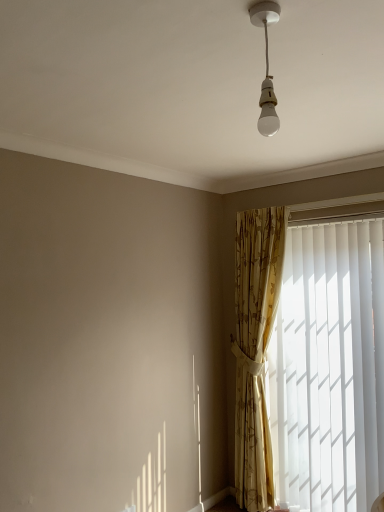
Question: Does gold floral fabric curtain at right have a greater height compared to white vertical blinds at right?

Choices:
 (A) no
 (B) yes

Answer: (B)

Question: Is gold floral fabric curtain at right turned away from white vertical blinds at right?

Choices:
 (A) yes
 (B) no

Answer: (B)

Question: Is gold floral fabric curtain at right positioned beyond the bounds of white vertical blinds at right?

Choices:
 (A) no
 (B) yes

Answer: (B)

Question: Does gold floral fabric curtain at right appear on the left side of white vertical blinds at right?

Choices:
 (A) yes
 (B) no

Answer: (A)

Question: Considering the relative sizes of gold floral fabric curtain at right and white vertical blinds at right in the image provided, is gold floral fabric curtain at right thinner than white vertical blinds at right?

Choices:
 (A) no
 (B) yes

Answer: (A)

Question: From a real-world perspective, is gold floral fabric curtain at right above or below white glossy bulb at upper center?

Choices:
 (A) above
 (B) below

Answer: (B)

Question: Considering the positions of point (258, 325) and point (273, 114), is point (258, 325) closer or farther from the camera than point (273, 114)?

Choices:
 (A) farther
 (B) closer

Answer: (A)

Question: Do you think gold floral fabric curtain at right is within white glossy bulb at upper center, or outside of it?

Choices:
 (A) outside
 (B) inside

Answer: (A)

Question: In the image, is gold floral fabric curtain at right on the left side or the right side of white glossy bulb at upper center?

Choices:
 (A) right
 (B) left

Answer: (A)

Question: Is white glossy bulb at upper center in front of or behind white vertical blinds at right in the image?

Choices:
 (A) front
 (B) behind

Answer: (A)

Question: Based on their sizes in the image, would you say white glossy bulb at upper center is bigger or smaller than white vertical blinds at right?

Choices:
 (A) big
 (B) small

Answer: (B)

Question: Which is correct: white glossy bulb at upper center is inside white vertical blinds at right, or outside of it?

Choices:
 (A) inside
 (B) outside

Answer: (B)

Question: Considering the relative positions of white glossy bulb at upper center and white vertical blinds at right in the image provided, is white glossy bulb at upper center to the left or to the right of white vertical blinds at right?

Choices:
 (A) left
 (B) right

Answer: (A)

Question: Considering the positions of white vertical blinds at right and white glossy bulb at upper center in the image, is white vertical blinds at right taller or shorter than white glossy bulb at upper center?

Choices:
 (A) tall
 (B) short

Answer: (A)

Question: Based on their sizes in the image, would you say white vertical blinds at right is bigger or smaller than white glossy bulb at upper center?

Choices:
 (A) big
 (B) small

Answer: (A)